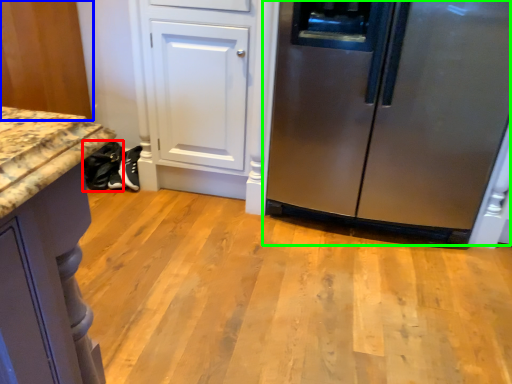
Question: Which is nearer to the footwear (highlighted by a red box)? cabinetry (highlighted by a blue box) or refrigerator (highlighted by a green box).

Choices:
 (A) cabinetry
 (B) refrigerator

Answer: (A)